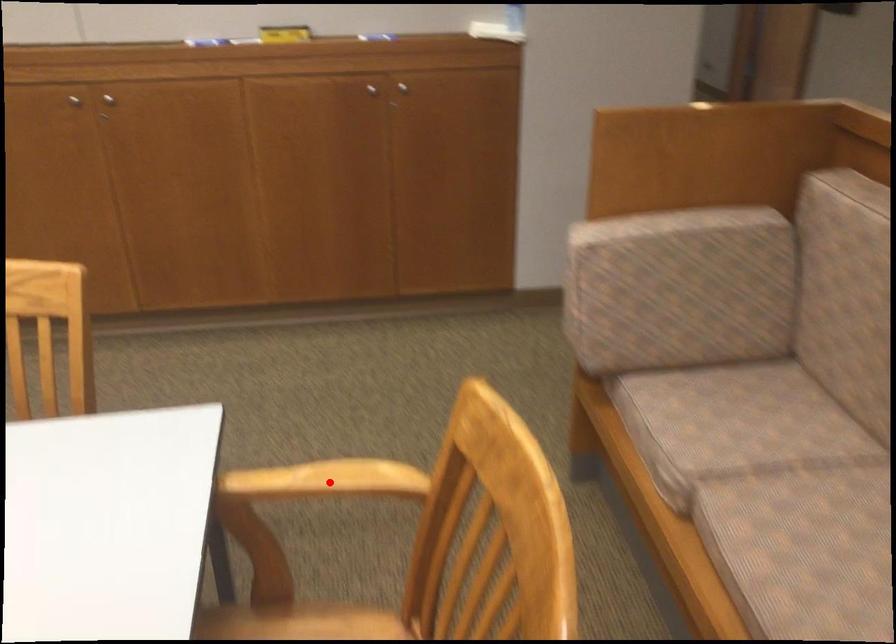
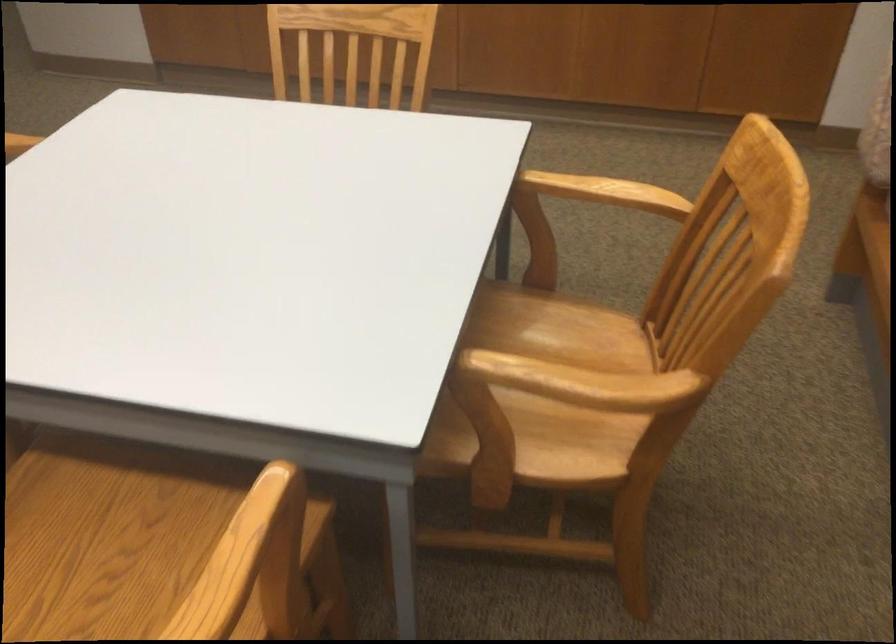
Question: I am providing you with two images of the same scene from different viewpoints. Given a red point in image1, look at the same physical point in image2. Is it:

Choices:
 (A) Closer to the viewpoint
 (B) Farther from the viewpoint

Answer: (B)